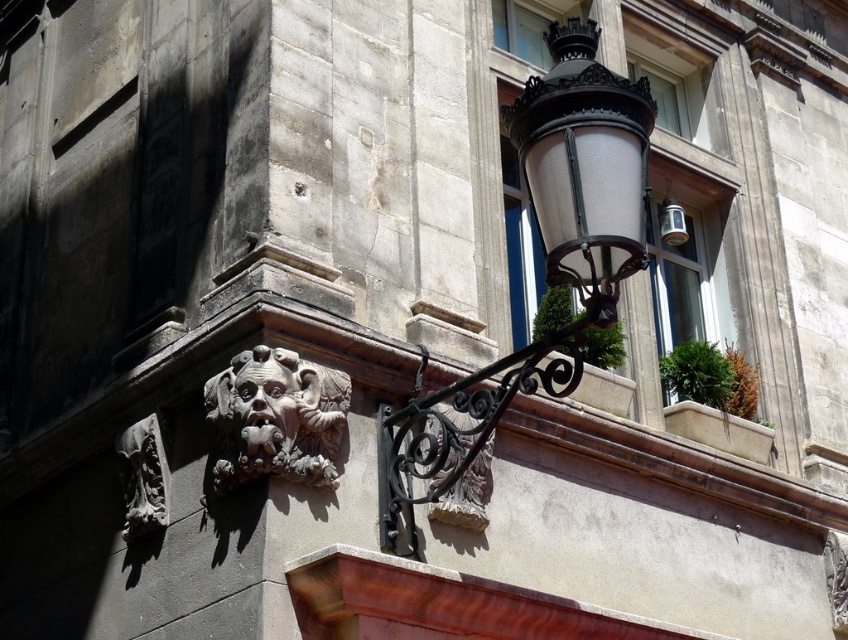
You are an architect analyzing the building facade. You need to determine which object is wider between the black wrought iron streetlight at upper right and the carved stone gargoyle at lower left. Based on the scene, which one is wider?

The black wrought iron streetlight at upper right is wider than the carved stone gargoyle at lower left according to the description.